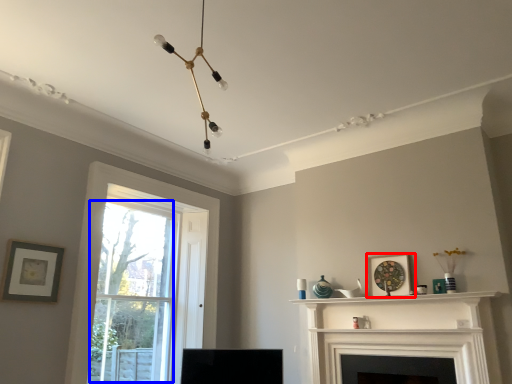
Question: Which of the following is the closest to the observer, picture frame (highlighted by a red box) or bay window (highlighted by a blue box)?

Choices:
 (A) picture frame
 (B) bay window

Answer: (A)